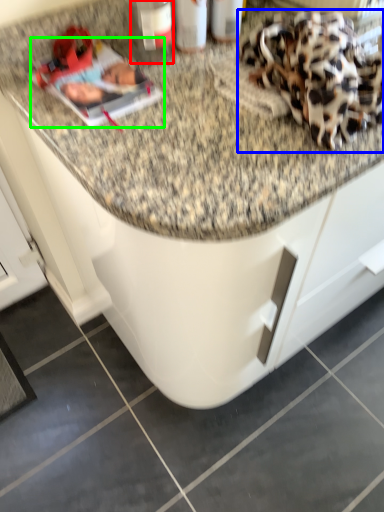
Question: Which is farther away from bottle (highlighted by a red box)? stuff (highlighted by a blue box) or magazine (highlighted by a green box)?

Choices:
 (A) stuff
 (B) magazine

Answer: (A)